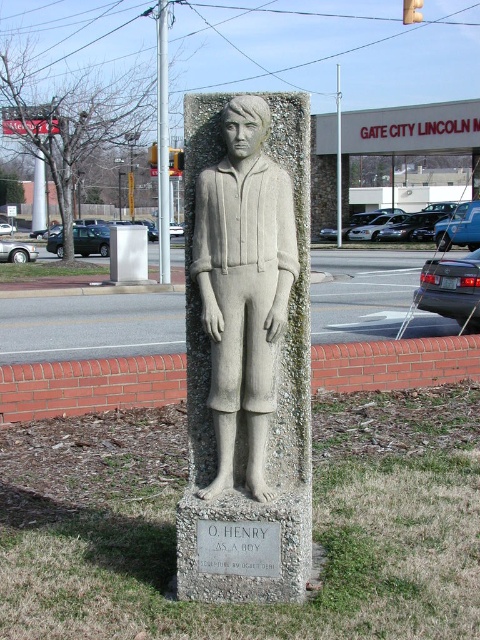
You are standing in a park and see the gray stone statue at center. If you take two steps forward, will you be closer than 2 meters to the statue?

The gray stone statue at center is 3.09 meters from viewer. If you take two steps forward, assuming each step is about 0.75 meters, you would be 3.09m minus 1.5m equals 1.59 meters away. Since 1.59 meters is less than 2 meters, you will be closer than 2 meters to the statue.

You are standing in a public park and see a statue of a boy. The statue is located at coordinates point (247,349). If you want to take a photo of the statue from a distance where it appears smaller, where should you stand relative to the point?

To make the statue appear smaller in your photo, you should move further away from the point (247,349) where the statue is located. The farther you are from the statue, the smaller it will appear in the frame.

You are standing in the park and want to take a photo of the gray stone statue at center. If you are positioned at point A, which is at coordinates 0.4, 0.5, will you be able to capture the entire statue in your camera frame without moving? The camera has a standard field of view of 60 degrees.

The gray stone statue at center is located at point (247, 349). Since your position at point A is at (240, 256), you are slightly to the left and slightly below the statue. With a 60 degree field of view, it is likely you can capture the entire statue without moving, as the distance between your position and the statue is within the camera angle.